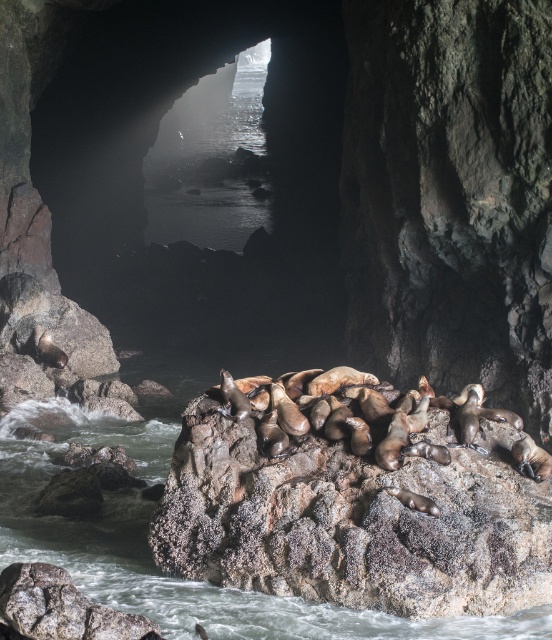
Does smooth rock cave at center have a lesser width compared to brown rough rock at center?

In fact, smooth rock cave at center might be wider than brown rough rock at center.

Is smooth rock cave at center to the left of brown rough rock at center from the viewer's perspective?

Indeed, smooth rock cave at center is positioned on the left side of brown rough rock at center.

At what (x,y) coordinates should I click in order to perform the action: click on smooth rock cave at center. Please return your answer as a coordinate pair (x, y). Image resolution: width=552 pixels, height=640 pixels. Looking at the image, I should click on (153, 148).